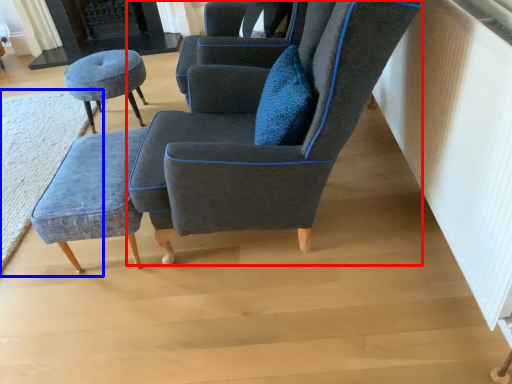
Question: Which object is further to the camera taking this photo, chair (highlighted by a red box) or mat (highlighted by a blue box)?

Choices:
 (A) chair
 (B) mat

Answer: (B)